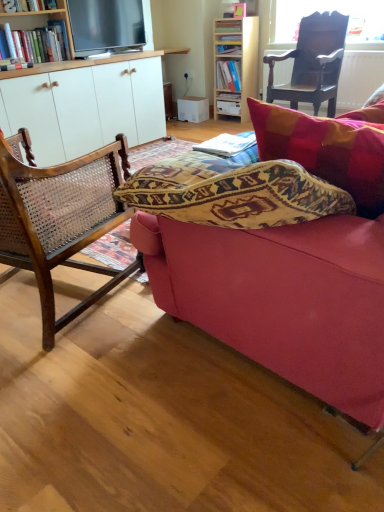
Describe the element at coordinates (313, 63) in the screenshot. I see `dark wood chair at upper right, which appears as the 1th chair when viewed from the right` at that location.

Where is `matte pink fabric couch at center`? matte pink fabric couch at center is located at coordinates (292, 267).

You are a GUI agent. You are given a task and a screenshot of the screen. Output one action in this format:
    pyautogui.click(x=<x>, y=<y>)
    Task: Click on the white paper at center, which appears as the 1th book when viewed from the front
    
    Given the screenshot: What is the action you would take?
    pyautogui.click(x=227, y=144)

Based on the photo, considering the positions of objects white paper at center, the fourth book viewed from the back, and hardcover book at center, the second book positioned from the bottom, in the image provided, who is in front, white paper at center, the fourth book viewed from the back, or hardcover book at center, the second book positioned from the bottom,?

white paper at center, the fourth book viewed from the back, is in front.

Which of these two, white paper at center, acting as the 4th book starting from the top, or hardcover book at center, the second book positioned from the bottom, is wider?

With larger width is white paper at center, acting as the 4th book starting from the top.

Considering the relative positions of white paper at center, the fourth book viewed from the back, and hardcover book at center, which is the 3th book from top to bottom, in the image provided, is white paper at center, the fourth book viewed from the back, to the left or to the right of hardcover book at center, which is the 3th book from top to bottom,?

white paper at center, the fourth book viewed from the back, is to the left of hardcover book at center, which is the 3th book from top to bottom.

From the image's perspective, would you say matte black television at upper left is shown under wooden cane chair at left, positioned as the second chair in right-to-left order?

No.

Is matte black television at upper left not near wooden cane chair at left, which is the first chair from front to back?

Yes, matte black television at upper left and wooden cane chair at left, which is the first chair from front to back, are located far from each other.

Who is smaller, matte black television at upper left or wooden cane chair at left, which ranks as the second chair in back-to-front order?

Result: matte black television at upper left.

In the image, is matte black television at upper left on the left side or the right side of wooden cane chair at left, positioned as the second chair in right-to-left order?

In the image, matte black television at upper left appears on the left side of wooden cane chair at left, positioned as the second chair in right-to-left order.

From a real-world perspective, starting from the matte black television at upper left, which book is the 2nd one below it? Please provide its 2D coordinates.

[(228, 75)]

Considering the points (99, 1) and (224, 85), which point is in front, point (99, 1) or point (224, 85)?

Positioned in front is point (99, 1).

Can you confirm if matte black television at upper left is wider than matte blue book at upper center, arranged as the third book when ordered from the bottom?

No, matte black television at upper left is not wider than matte blue book at upper center, arranged as the third book when ordered from the bottom.

How different are the orientations of dark wood chair at upper right, the second chair when ordered from bottom to top, and hardcover book at center, the first book when ordered from back to front, in degrees?

dark wood chair at upper right, the second chair when ordered from bottom to top, and hardcover book at center, the first book when ordered from back to front, are facing 2.07 degrees away from each other.

From a real-world perspective, is dark wood chair at upper right, placed as the first chair when sorted from back to front, positioned above or below hardcover book at center, which is the 3th book from top to bottom?

In terms of real-world spatial position, dark wood chair at upper right, placed as the first chair when sorted from back to front, is above hardcover book at center, which is the 3th book from top to bottom.

Is dark wood chair at upper right, the second chair when ordered from bottom to top, thinner than hardcover book at center, the first book when ordered from back to front?

No, dark wood chair at upper right, the second chair when ordered from bottom to top, is not thinner than hardcover book at center, the first book when ordered from back to front.

From the picture: From the image's perspective, is dark wood chair at upper right, the second chair when ordered from bottom to top, under hardcover book at center, the first book when ordered from back to front?

Indeed, from the image's perspective, dark wood chair at upper right, the second chair when ordered from bottom to top, is shown beneath hardcover book at center, the first book when ordered from back to front.

Who is more distant, matte blue book at upper center, which is the 3th book from front to back, or hardcover book at upper center, which ranks as the 4th book in bottom-to-top order?

matte blue book at upper center, which is the 3th book from front to back, is more distant.

From a real-world perspective, is matte blue book at upper center, positioned as the 2th book in top-to-bottom order, located beneath hardcover book at upper center, placed as the 1th book when sorted from top to bottom?

Yes.

At what (x,y) coordinates should I click in order to perform the action: click on book that appears above the matte blue book at upper center, arranged as the third book when ordered from the bottom (from the image's perspective). Please return your answer as a coordinate pair (x, y). The image size is (384, 512). Looking at the image, I should click on (228, 27).

Considering the sizes of matte blue book at upper center, which is the 3th book from front to back, and hardcover book at upper center, which ranks as the third book in back-to-front order, in the image, is matte blue book at upper center, which is the 3th book from front to back, taller or shorter than hardcover book at upper center, which ranks as the third book in back-to-front order,?

Considering their sizes, matte blue book at upper center, which is the 3th book from front to back, has more height than hardcover book at upper center, which ranks as the third book in back-to-front order.

Is hardcover book at upper center, placed as the 1th book when sorted from top to bottom, behind matte black television at upper left?

Yes, hardcover book at upper center, placed as the 1th book when sorted from top to bottom, is further from the camera.

Is hardcover book at upper center, which ranks as the third book in back-to-front order, bigger than matte black television at upper left?

No.

Is hardcover book at upper center, acting as the 2th book starting from the front, next to matte black television at upper left?

hardcover book at upper center, acting as the 2th book starting from the front, and matte black television at upper left are not in contact.

From the image's perspective, which is below, wooden cane chair at left, arranged as the 1th chair when ordered from the bottom, or matte pink fabric couch at center?

wooden cane chair at left, arranged as the 1th chair when ordered from the bottom, from the image's perspective.

Can you see wooden cane chair at left, positioned as the second chair in right-to-left order, touching matte pink fabric couch at center?

No, wooden cane chair at left, positioned as the second chair in right-to-left order, is not in contact with matte pink fabric couch at center.

Considering the positions of points (11, 213) and (194, 322), is point (11, 213) farther from camera compared to point (194, 322)?

No, it is in front of (194, 322).

There is a hardcover book at center, which is the 3th book from top to bottom. Find the location of `the 1st book above it (from a real-world perspective)`. the 1st book above it (from a real-world perspective) is located at coordinates (227, 144).

Find the location of a particular element. This screenshot has height=512, width=384. the 2nd chair below the matte black television at upper left (from the image's perspective) is located at coordinates (61, 221).

Which object lies further to the anchor point matte blue book at upper center, arranged as the third book when ordered from the bottom, dark wood chair at upper right, the second chair when ordered from bottom to top, or wooden cane chair at left, which is the first chair from front to back?

Based on the image, wooden cane chair at left, which is the first chair from front to back, appears to be further to matte blue book at upper center, arranged as the third book when ordered from the bottom.

Looking at the image, which one is located closer to dark wood chair at upper right, marked as the 2th chair in a front-to-back arrangement, light wood bookcase at upper center or matte black television at upper left?

light wood bookcase at upper center.

Looking at the image, which one is located further to matte pink fabric couch at center, matte blue book at upper center, arranged as the third book when ordered from the bottom, or white paper at center, which appears as the 1th book when viewed from the front?

matte blue book at upper center, arranged as the third book when ordered from the bottom, lies further to matte pink fabric couch at center than the other object.

Looking at the image, which one is located further to matte pink fabric couch at center, light wood bookcase at upper center or matte blue book at upper center, positioned as the 2th book in top-to-bottom order?

matte blue book at upper center, positioned as the 2th book in top-to-bottom order, lies further to matte pink fabric couch at center than the other object.

From the image, which object appears to be farther from light wood bookcase at upper center, matte black television at upper left or matte pink fabric couch at center?

Among the two, matte pink fabric couch at center is located further to light wood bookcase at upper center.

From the image, which object appears to be nearer to hardcover book at center, the 4th book when ordered from front to back, matte blue book at upper center, which is the 3th book from front to back, or light wood bookcase at upper center?

matte blue book at upper center, which is the 3th book from front to back.

From the image, which object appears to be nearer to white paper at center, the fourth book viewed from the back, light wood bookcase at upper center or matte pink fabric couch at center?

Based on the image, matte pink fabric couch at center appears to be nearer to white paper at center, the fourth book viewed from the back.

Looking at the image, which one is located further to wooden cane chair at left, positioned as the second chair in right-to-left order, hardcover book at center, the 4th book when ordered from front to back, or matte pink fabric couch at center?

hardcover book at center, the 4th book when ordered from front to back, is positioned further to the anchor wooden cane chair at left, positioned as the second chair in right-to-left order.

Locate an element on the screen. This screenshot has width=384, height=512. television positioned between wooden cane chair at left, positioned as the second chair in right-to-left order, and hardcover book at center, which is the 3th book from top to bottom, from near to far is located at coordinates (106, 26).

Where is `book between matte pink fabric couch at center and matte black television at upper left in the front-back direction`? The width and height of the screenshot is (384, 512). book between matte pink fabric couch at center and matte black television at upper left in the front-back direction is located at coordinates (227, 144).

Find the location of `entertainment center between wooden cane chair at left, positioned as the second chair in right-to-left order, and light wood bookcase at upper center from front to back`. entertainment center between wooden cane chair at left, positioned as the second chair in right-to-left order, and light wood bookcase at upper center from front to back is located at coordinates (85, 104).

This screenshot has height=512, width=384. Find the location of `television located between matte pink fabric couch at center and light wood bookcase at upper center in the depth direction`. television located between matte pink fabric couch at center and light wood bookcase at upper center in the depth direction is located at coordinates (106, 26).